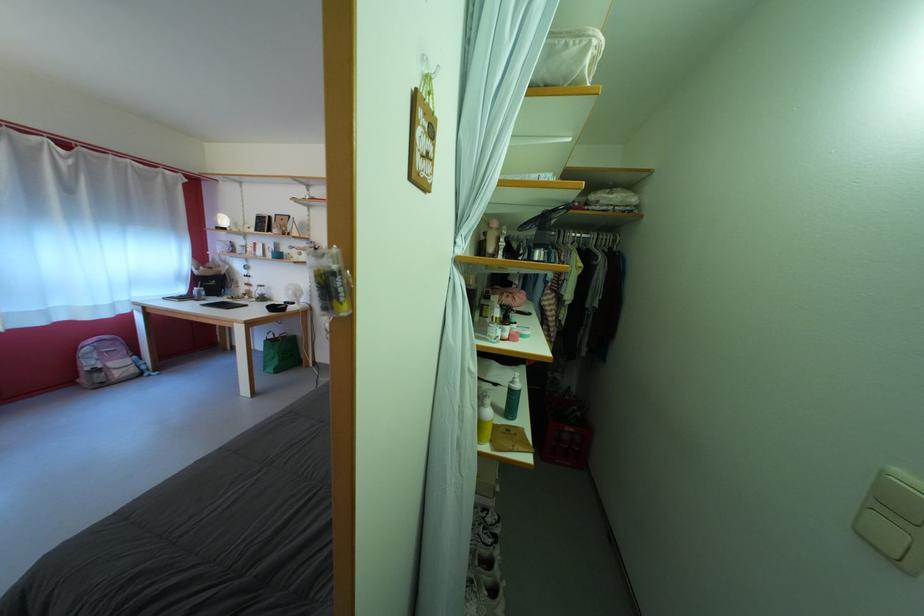
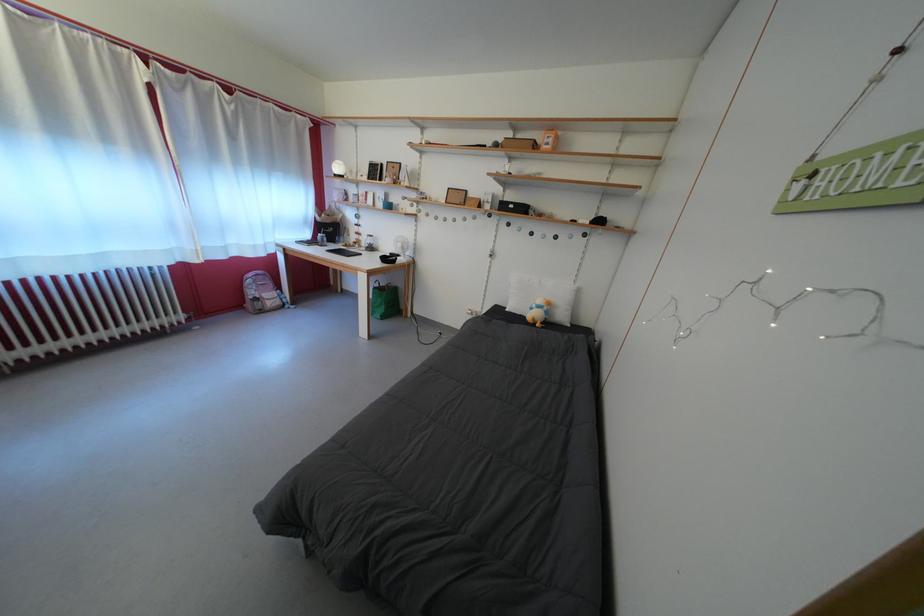
Locate, in the second image, the point that corresponds to point 256,294 in the first image.

(365, 243)